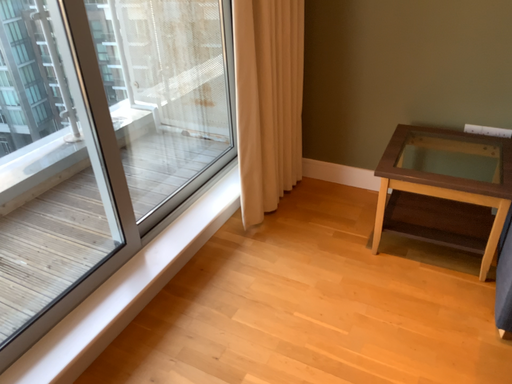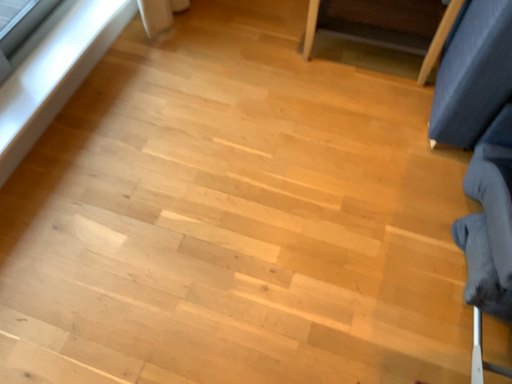
Question: Which way did the camera rotate in the video?

Choices:
 (A) rotated upward
 (B) rotated downward

Answer: (B)